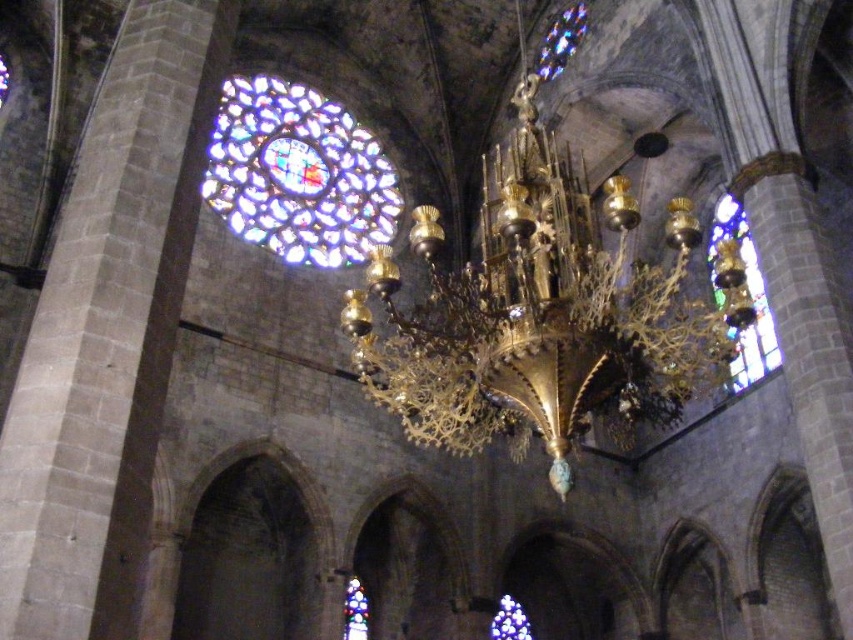
Question: Which point appears closest to the camera in this image?

Choices:
 (A) (531, 257)
 (B) (756, 301)
 (C) (364, 625)
 (D) (329, 234)

Answer: (A)

Question: Can you confirm if gold metallic chandelier at center is smaller than stained glass at upper center?

Choices:
 (A) yes
 (B) no

Answer: (B)

Question: Which object appears closest to the camera in this image?

Choices:
 (A) stained glass window at center
 (B) stained glass at upper center
 (C) gold metallic chandelier at center

Answer: (C)

Question: Is gold metallic chandelier at center closer to the viewer compared to stained glass window at right?

Choices:
 (A) yes
 (B) no

Answer: (A)

Question: Observing the image, what is the correct spatial positioning of stained glass at upper center in reference to stained glass window at center?

Choices:
 (A) left
 (B) right

Answer: (A)

Question: Which of the following is the farthest from the observer?

Choices:
 (A) [x=360, y=602]
 (B) [x=252, y=188]
 (C) [x=769, y=352]

Answer: (B)